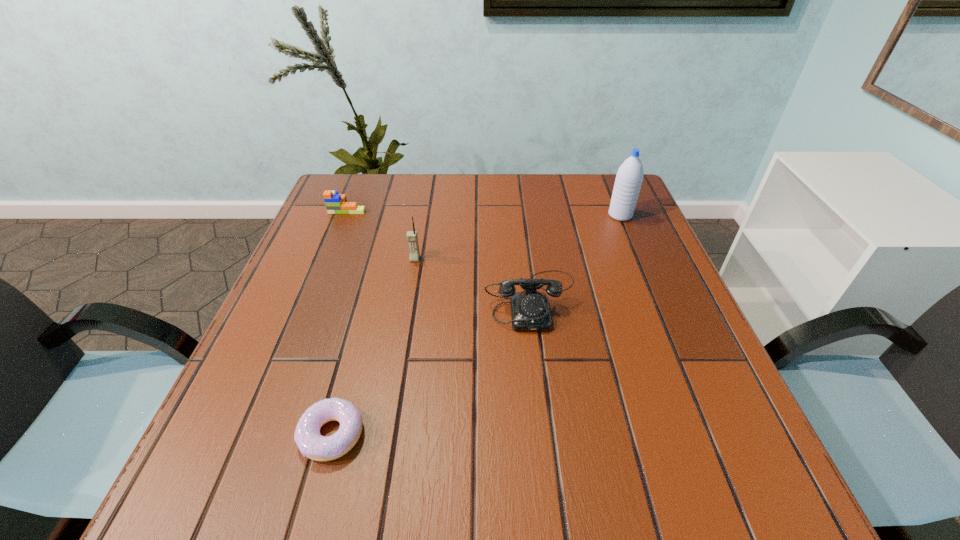
At what (x,y) coordinates should I click in order to perform the action: click on object that is at the right edge. Please return your answer as a coordinate pair (x, y). Looking at the image, I should click on (629, 177).

This screenshot has width=960, height=540. What are the coordinates of `object that is positioned at the far left corner` in the screenshot? It's located at (335, 203).

This screenshot has width=960, height=540. Identify the location of object that is at the near left corner. (311, 443).

Locate an element on the screen. This screenshot has height=540, width=960. object that is at the far right corner is located at coordinates (629, 177).

The height and width of the screenshot is (540, 960). I want to click on vacant space at the far edge of the desktop, so click(x=450, y=190).

In the image, there is a desktop. Where is `vacant space at the left edge`? The height and width of the screenshot is (540, 960). vacant space at the left edge is located at coordinates (346, 245).

You are a GUI agent. You are given a task and a screenshot of the screen. Output one action in this format:
    pyautogui.click(x=<x>, y=<y>)
    Task: Click on the free space at the right edge
    
    Given the screenshot: What is the action you would take?
    pyautogui.click(x=659, y=300)

Locate an element on the screen. Image resolution: width=960 pixels, height=540 pixels. vacant space at the far left corner is located at coordinates (372, 180).

At what (x,y) coordinates should I click in order to perform the action: click on vacant space at the near left corner. Please return your answer as a coordinate pair (x, y). Looking at the image, I should click on (237, 474).

This screenshot has width=960, height=540. In the image, there is a desktop. Find the location of `vacant space at the far right corner`. vacant space at the far right corner is located at coordinates (574, 179).